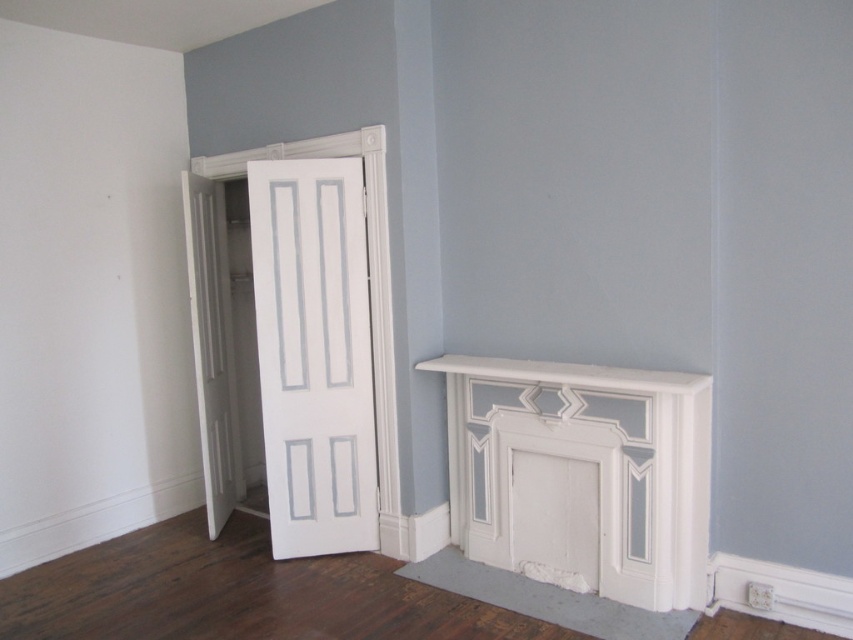
Does point (637, 528) come farther from viewer compared to point (581, 378)?

Yes.

Is white painted wood fireplace at lower right bigger than white painted wood mantle at lower right?

Correct, white painted wood fireplace at lower right is larger in size than white painted wood mantle at lower right.

The height and width of the screenshot is (640, 853). Describe the element at coordinates (582, 474) in the screenshot. I see `white painted wood fireplace at lower right` at that location.

Locate an element on the screen. This screenshot has width=853, height=640. white painted wood fireplace at lower right is located at coordinates (582, 474).